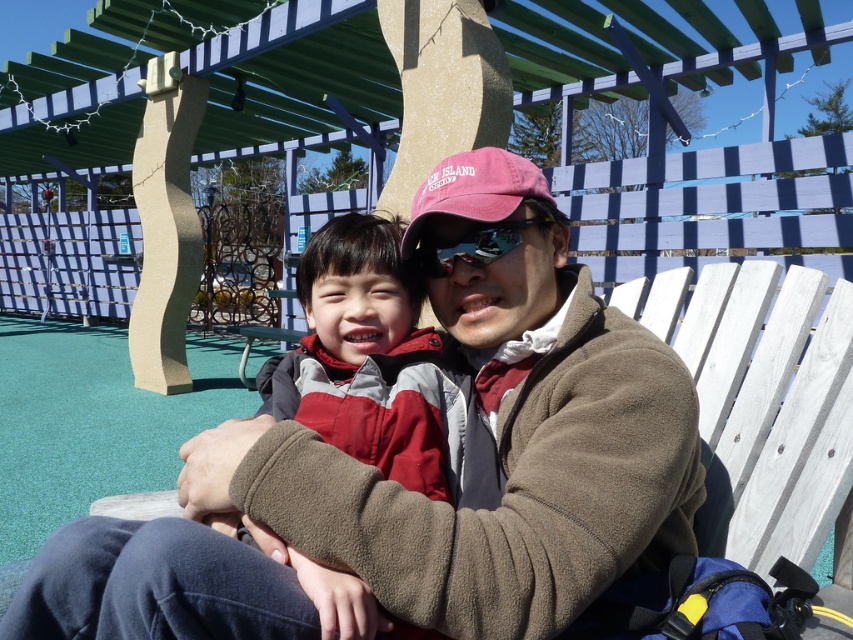
Question: Is red fleece jacket at center to the left of maroon fabric baseball cap at center from the viewer's perspective?

Choices:
 (A) no
 (B) yes

Answer: (B)

Question: Which object is closer to the camera taking this photo?

Choices:
 (A) brown fleece jacket at center
 (B) maroon fabric baseball cap at center
 (C) sunglasses at center
 (D) red fleece jacket at center

Answer: (A)

Question: Which of these objects is positioned closest to the maroon fabric baseball cap at center?

Choices:
 (A) brown fleece jacket at center
 (B) sunglasses at center
 (C) red fleece jacket at center

Answer: (B)

Question: Is maroon fabric baseball cap at center to the left of sunglasses at center from the viewer's perspective?

Choices:
 (A) yes
 (B) no

Answer: (A)

Question: Does red fleece jacket at center have a smaller size compared to sunglasses at center?

Choices:
 (A) no
 (B) yes

Answer: (A)

Question: Which point is farther to the camera?

Choices:
 (A) red fleece jacket at center
 (B) sunglasses at center

Answer: (B)